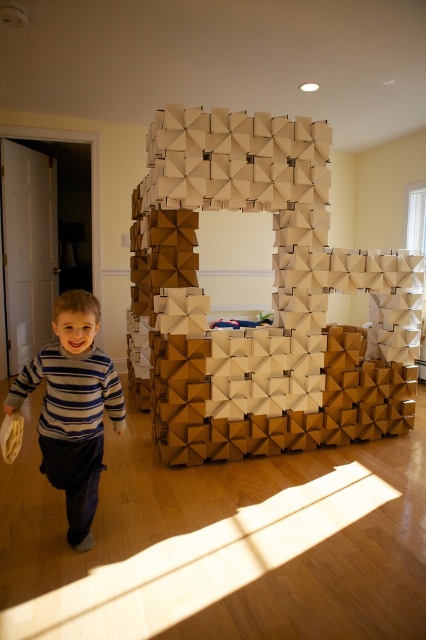
Does white cardboard structure at center have a lesser height compared to striped sweater at center?

No.

Can you confirm if white cardboard structure at center is smaller than striped sweater at center?

No.

What do you see at coordinates (271, 296) in the screenshot? The height and width of the screenshot is (640, 426). I see `white cardboard structure at center` at bounding box center [271, 296].

Locate an element on the screen. The width and height of the screenshot is (426, 640). white cardboard structure at center is located at coordinates (271, 296).